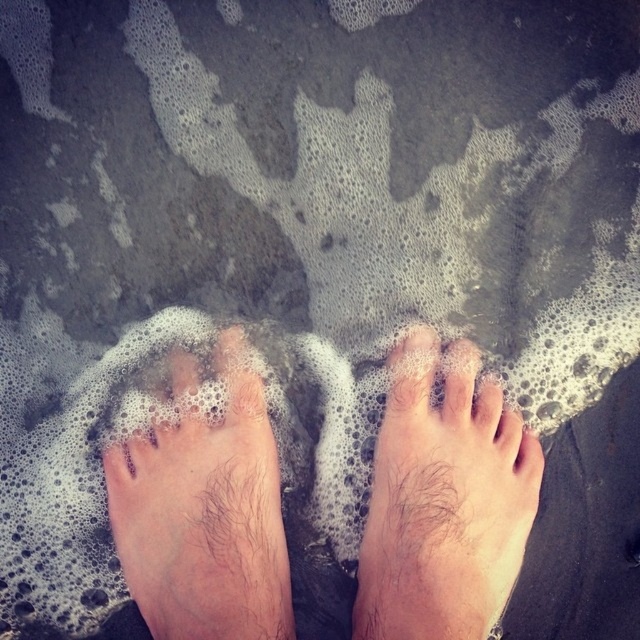
You are standing on the beach and see the hairy skin feet at center and the hairy skin foot at lower center. Which one is positioned more to the left side?

The hairy skin feet at center is positioned more to the left side than the hairy skin foot at lower center.

You are a photographer trying to capture the exact position of the hairy skin foot at lower center. According to the coordinates provided, where should you focus your camera lens?

The hairy skin foot at lower center is located at point (444,500), so you should focus your camera lens precisely at those coordinates to capture its exact position.